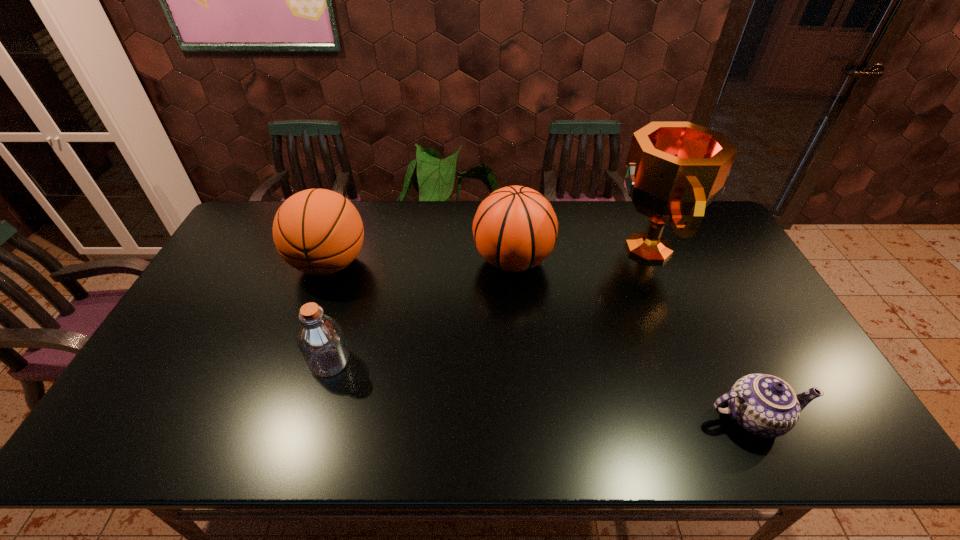
Identify the location of free space located 0.270m on the left of the third object from left to right. (391, 261).

This screenshot has height=540, width=960. Identify the location of vacant space located 0.050m on the left of the left basketball. (274, 264).

In order to click on free space located 0.160m on the right of the bottle in this screenshot , I will do `click(411, 361)`.

In order to click on award located in the far edge section of the desktop in this screenshot , I will do `click(674, 170)`.

What are the coordinates of `object at the near edge` in the screenshot? It's located at (765, 405).

The image size is (960, 540). Find the location of `award present at the right edge`. award present at the right edge is located at coordinates (674, 170).

You are a GUI agent. You are given a task and a screenshot of the screen. Output one action in this format:
    pyautogui.click(x=<x>, y=<y>)
    Task: Click on the chinaware located at the right edge
    The width and height of the screenshot is (960, 540).
    Given the screenshot: What is the action you would take?
    pyautogui.click(x=765, y=405)

At what (x,y) coordinates should I click in order to perform the action: click on object that is at the far right corner. Please return your answer as a coordinate pair (x, y). This screenshot has width=960, height=540. Looking at the image, I should click on (674, 170).

The image size is (960, 540). Find the location of `object positioned at the near right corner`. object positioned at the near right corner is located at coordinates (765, 405).

Locate an element on the screen. The width and height of the screenshot is (960, 540). vacant space at the far edge of the desktop is located at coordinates (406, 230).